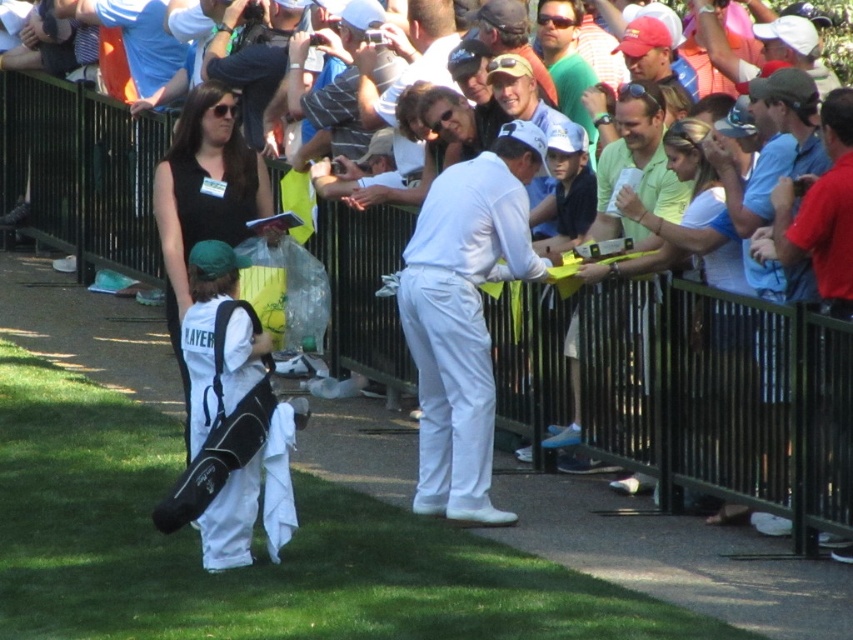
Question: Which of the following is the closest to the observer?

Choices:
 (A) (666, 189)
 (B) (838, 296)

Answer: (B)

Question: Considering the relative positions of white matte golf pants at center and light green shirt at center in the image provided, where is white matte golf pants at center located with respect to light green shirt at center?

Choices:
 (A) right
 (B) left

Answer: (B)

Question: Can you confirm if white matte golf pants at center is positioned to the left of red shirt at center?

Choices:
 (A) no
 (B) yes

Answer: (B)

Question: Considering the real-world distances, which object is closest to the red shirt at center?

Choices:
 (A) white matte golf pants at center
 (B) light green shirt at center

Answer: (B)

Question: Can you confirm if white matte golf pants at center is positioned above light green shirt at center?

Choices:
 (A) no
 (B) yes

Answer: (A)

Question: Which point appears farthest from the camera in this image?

Choices:
 (A) (827, 280)
 (B) (509, 200)

Answer: (B)